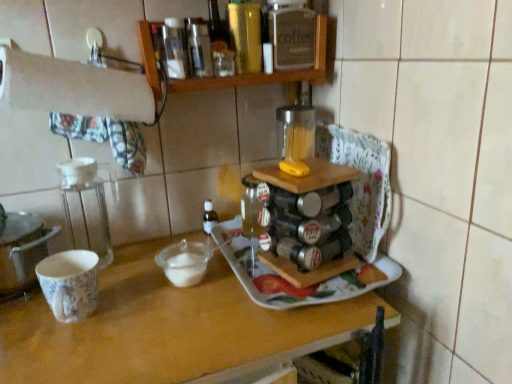
Where is `free space on the front side of transparent glass mixing bowl at center`? The width and height of the screenshot is (512, 384). free space on the front side of transparent glass mixing bowl at center is located at coordinates (170, 326).